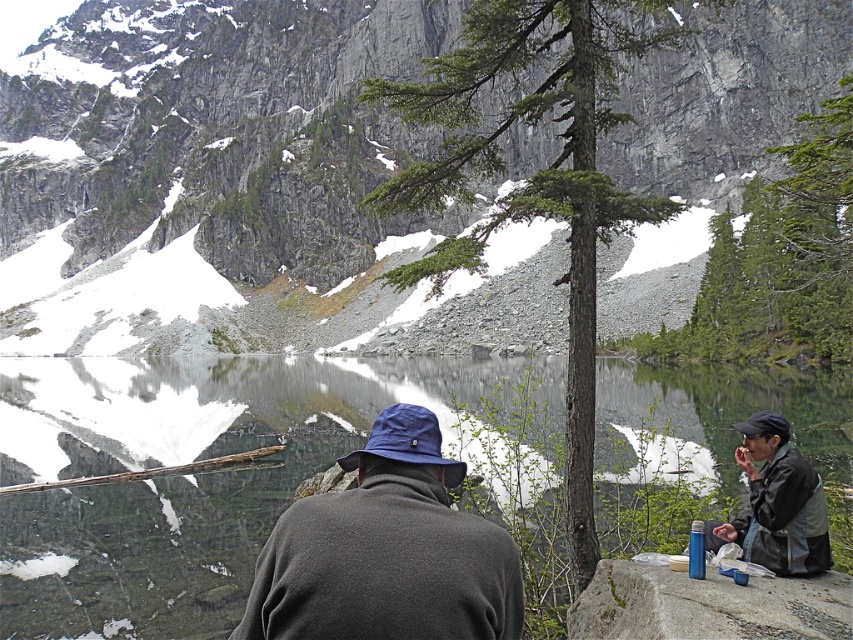
Does gray rocky mountain at center have a lesser width compared to dark gray jacket at lower right?

No.

What are the coordinates of `gray rocky mountain at center` in the screenshot? It's located at (236, 188).

Identify the location of gray rocky mountain at center. The image size is (853, 640). (236, 188).

Can you confirm if gray rocky mountain at center is wider than dark gray fleece jacket at center?

Yes.

Where is `gray rocky mountain at center`? gray rocky mountain at center is located at coordinates (236, 188).

The height and width of the screenshot is (640, 853). In order to click on gray rocky mountain at center in this screenshot , I will do `click(236, 188)`.

Can you confirm if gray rocky mountain at center is positioned to the right of blue-green rock at lower right?

In fact, gray rocky mountain at center is to the left of blue-green rock at lower right.

Can you confirm if gray rocky mountain at center is positioned below blue-green rock at lower right?

No, gray rocky mountain at center is not below blue-green rock at lower right.

Does point (339, 106) come behind point (628, 620)?

Yes, it is.

This screenshot has height=640, width=853. I want to click on gray rocky mountain at center, so click(236, 188).